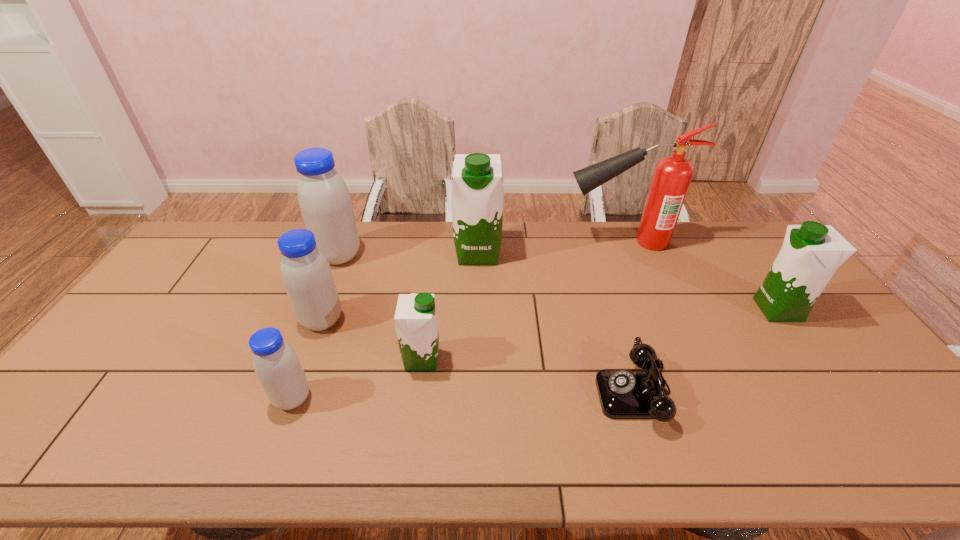
Image resolution: width=960 pixels, height=540 pixels. What are the coordinates of `red fire extinguisher` in the screenshot? It's located at (672, 175).

Locate an element on the screen. This screenshot has width=960, height=540. the biggest blue soya milk is located at coordinates (324, 200).

You are a GUI agent. You are given a task and a screenshot of the screen. Output one action in this format:
    pyautogui.click(x=<x>, y=<y>)
    Task: Click on the biggest green soya milk
    The image size is (960, 540).
    Given the screenshot: What is the action you would take?
    pyautogui.click(x=477, y=194)

Locate an element on the screen. the farthest green soya milk is located at coordinates (477, 194).

Identify the location of the rightmost soya milk. (811, 253).

You are a GUI agent. You are given a task and a screenshot of the screen. Output one action in this format:
    pyautogui.click(x=<x>, y=<y>)
    Task: Click on the rightmost object
    The height and width of the screenshot is (540, 960).
    Given the screenshot: What is the action you would take?
    pyautogui.click(x=811, y=253)

In order to click on the second nearest blue soya milk in this screenshot , I will do coord(306,274).

The image size is (960, 540). What are the coordinates of `the third soya milk from right to left` in the screenshot? It's located at (416, 324).

The image size is (960, 540). I want to click on the nearest green soya milk, so click(x=416, y=324).

At what (x,y) coordinates should I click in order to perform the action: click on the nearest soya milk. Please return your answer as a coordinate pair (x, y). The image size is (960, 540). Looking at the image, I should click on (277, 366).